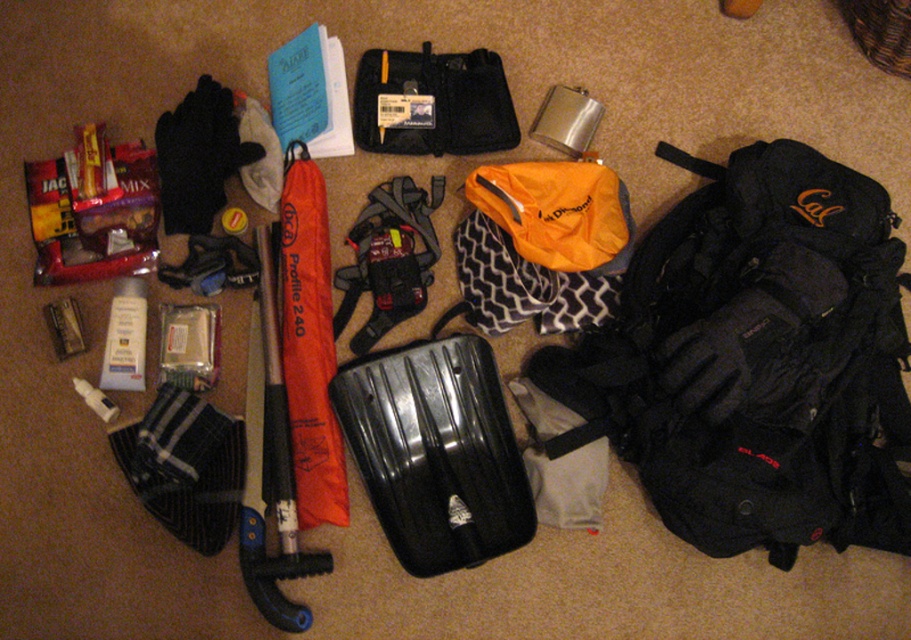
You are standing at the origin of a coordinate system placed on the floor. The coordinates of the matte black backpack at right are given as point (756, 360). If you walk straight ahead, will you reach the matte black backpack at right before or after passing the orange umbrella labeled BCA Profile 240?

A: The coordinates of the matte black backpack at right are point (756, 360), so walking straight ahead from the origin, you will reach the matte black backpack at right after passing the orange umbrella labeled BCA Profile 240.

You are organizing items on the floor and need to stack the matte black backpack at right and the black hard shell suitcase at center vertically. Which one should you place at the bottom to ensure stability?

The matte black backpack at right is taller than the black hard shell suitcase at center, so placing the taller backpack at the bottom would provide better stability for the stack.

You are standing 1.5 meters away from the camera. Can you reach the black hard shell suitcase at center without moving your feet?

The black hard shell suitcase at center is 1.32 meters away from the camera. Since you are standing 1.5 meters away from the camera, the distance between you and the suitcase is 1.5 meters minus 1.32 meters, which equals 0.18 meters. This means the suitcase is only 18 centimeters away from you, so you can easily reach it without moving your feet.